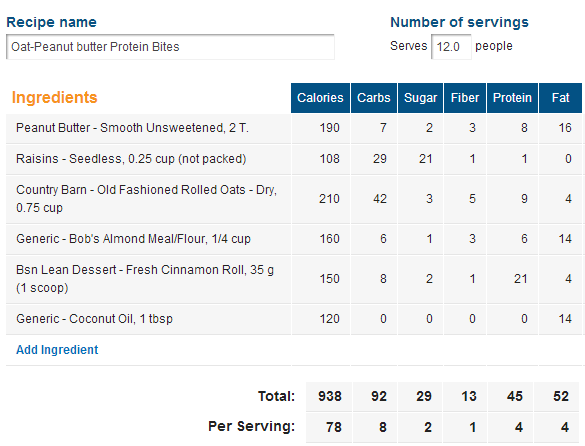
Find the location of a particular element. table is located at coordinates (283, 118).